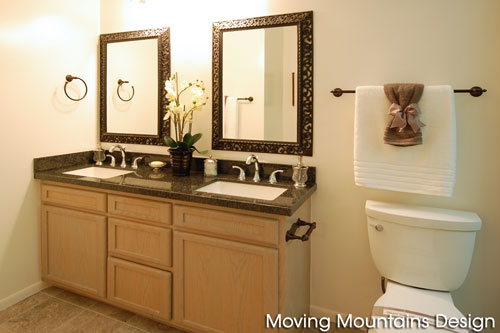
The width and height of the screenshot is (500, 333). I want to click on faucets, so click(250, 156), click(120, 146).